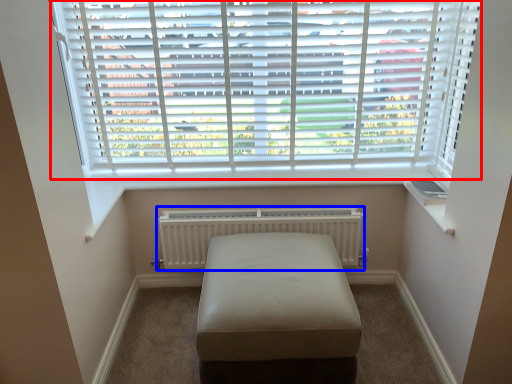
Question: Which object appears closest to the camera in this image, window blind (highlighted by a red box) or radiator (highlighted by a blue box)?

Choices:
 (A) window blind
 (B) radiator

Answer: (A)